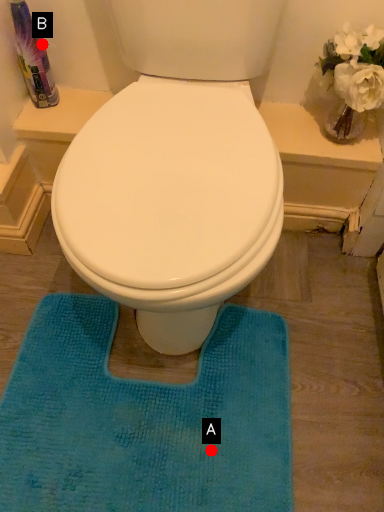
Question: Two points are circled on the image, labeled by A and B beside each circle. Among these points, which one is nearest to the camera?

Choices:
 (A) A is closer
 (B) B is closer

Answer: (A)